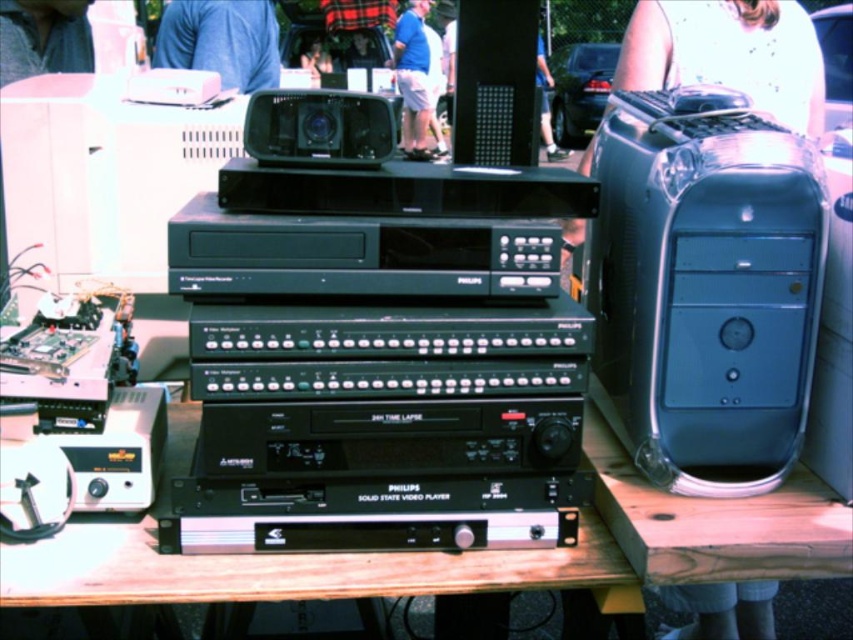
Which is behind, point (827, 240) or point (534, 12)?

Positioned behind is point (534, 12).

Does satin silver computer tower at right appear on the left side of black matte speaker at upper center?

In fact, satin silver computer tower at right is to the right of black matte speaker at upper center.

You are a GUI agent. You are given a task and a screenshot of the screen. Output one action in this format:
    pyautogui.click(x=<x>, y=<y>)
    Task: Click on the satin silver computer tower at right
    
    Given the screenshot: What is the action you would take?
    pyautogui.click(x=705, y=288)

Identify the location of satin silver computer tower at right. The image size is (853, 640). (705, 288).

From the picture: Is the position of satin silver computer tower at right more distant than that of black plastic radio at center?

No, it is not.

Between satin silver computer tower at right and black plastic radio at center, which one appears on the right side from the viewer's perspective?

From the viewer's perspective, satin silver computer tower at right appears more on the right side.

Is point (697, 152) positioned after point (311, 118)?

That is False.

Locate an element on the screen. This screenshot has width=853, height=640. satin silver computer tower at right is located at coordinates (705, 288).

Between black matte speaker at upper center and black plastic radio at center, which one has more height?

black matte speaker at upper center

Between black matte speaker at upper center and black plastic radio at center, which one appears on the left side from the viewer's perspective?

Positioned to the left is black plastic radio at center.

The image size is (853, 640). What are the coordinates of `black matte speaker at upper center` in the screenshot? It's located at (495, 83).